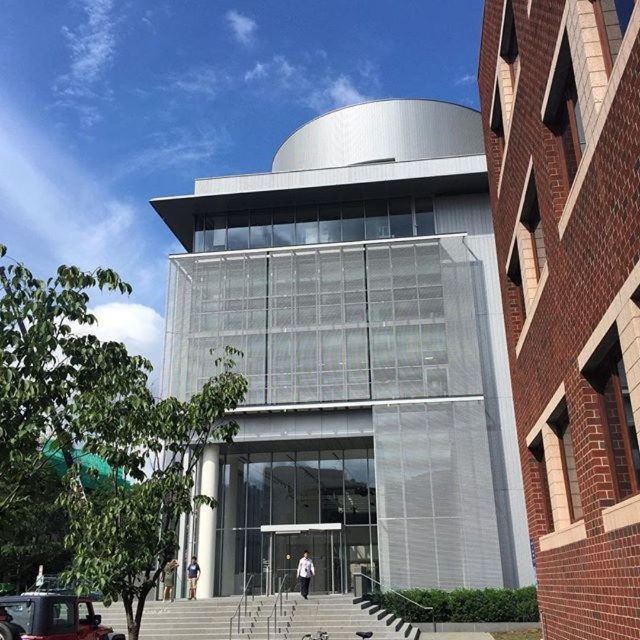
Is white fabric shirt at center to the left of light brown leather jacket at lower center from the viewer's perspective?

In fact, white fabric shirt at center is to the right of light brown leather jacket at lower center.

Is white fabric shirt at center behind light brown leather jacket at lower center?

No, white fabric shirt at center is closer to the viewer.

Is point (301, 576) less distant than point (189, 570)?

That is True.

You are a GUI agent. You are given a task and a screenshot of the screen. Output one action in this format:
    pyautogui.click(x=<x>, y=<y>)
    Task: Click on the white fabric shirt at center
    The height and width of the screenshot is (640, 640).
    Given the screenshot: What is the action you would take?
    pyautogui.click(x=305, y=573)

Which is below, gray concrete stairs at center or light brown leather jacket at lower center?

light brown leather jacket at lower center is below.

Does gray concrete stairs at center have a lesser width compared to light brown leather jacket at lower center?

In fact, gray concrete stairs at center might be wider than light brown leather jacket at lower center.

Describe the element at coordinates (269, 618) in the screenshot. The height and width of the screenshot is (640, 640). I see `gray concrete stairs at center` at that location.

Image resolution: width=640 pixels, height=640 pixels. In order to click on gray concrete stairs at center in this screenshot , I will do `click(269, 618)`.

Is matte black car at lower left further to camera compared to white matte jacket at center?

Yes, it is.

Who is more distant from viewer, (116, 637) or (164, 579)?

The point (164, 579) is more distant.

You are a GUI agent. You are given a task and a screenshot of the screen. Output one action in this format:
    pyautogui.click(x=<x>, y=<y>)
    Task: Click on the matte black car at lower left
    
    Given the screenshot: What is the action you would take?
    pyautogui.click(x=51, y=618)